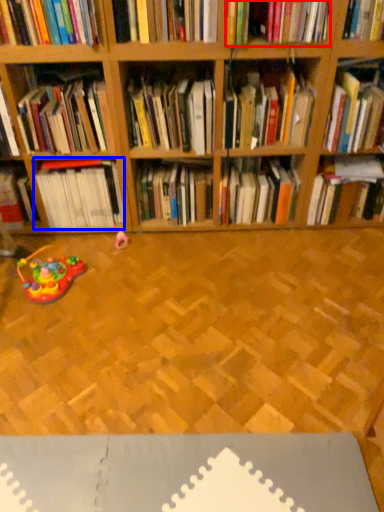
Question: Among these objects, which one is nearest to the camera, book (highlighted by a red box) or book (highlighted by a blue box)?

Choices:
 (A) book
 (B) book

Answer: (A)